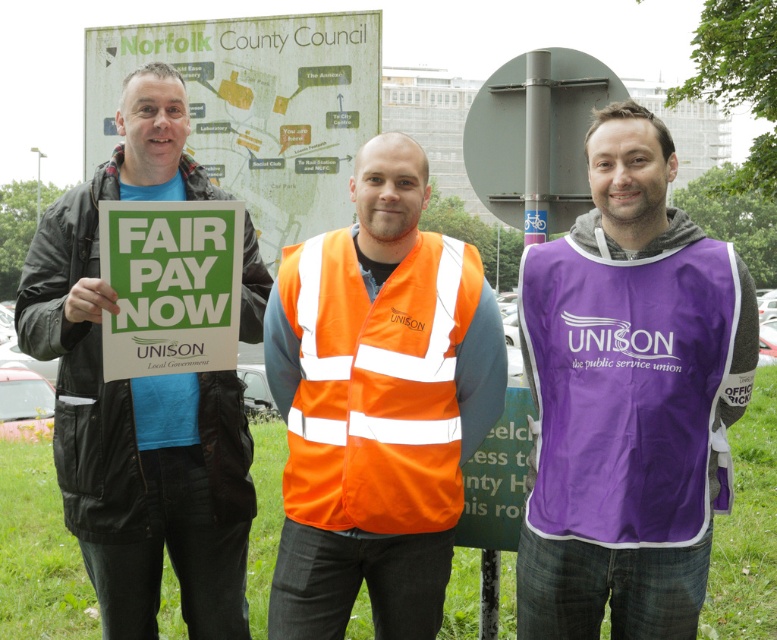
Question: Does purple fabric vest at center appear on the right side of matte black jacket at left?

Choices:
 (A) yes
 (B) no

Answer: (A)

Question: Does purple fabric vest at center appear under orange reflective safety vest at center?

Choices:
 (A) no
 (B) yes

Answer: (A)

Question: Which of these objects is positioned closest to the matte black jacket at left?

Choices:
 (A) purple fabric vest at center
 (B) orange reflective safety vest at center

Answer: (B)

Question: Is the position of matte black jacket at left more distant than that of orange reflective safety vest at center?

Choices:
 (A) no
 (B) yes

Answer: (B)

Question: Among these points, which one is farthest from the camera?

Choices:
 (A) (697, 472)
 (B) (352, 352)

Answer: (B)

Question: Which object is farther from the camera taking this photo?

Choices:
 (A) purple fabric vest at center
 (B) matte black jacket at left

Answer: (B)